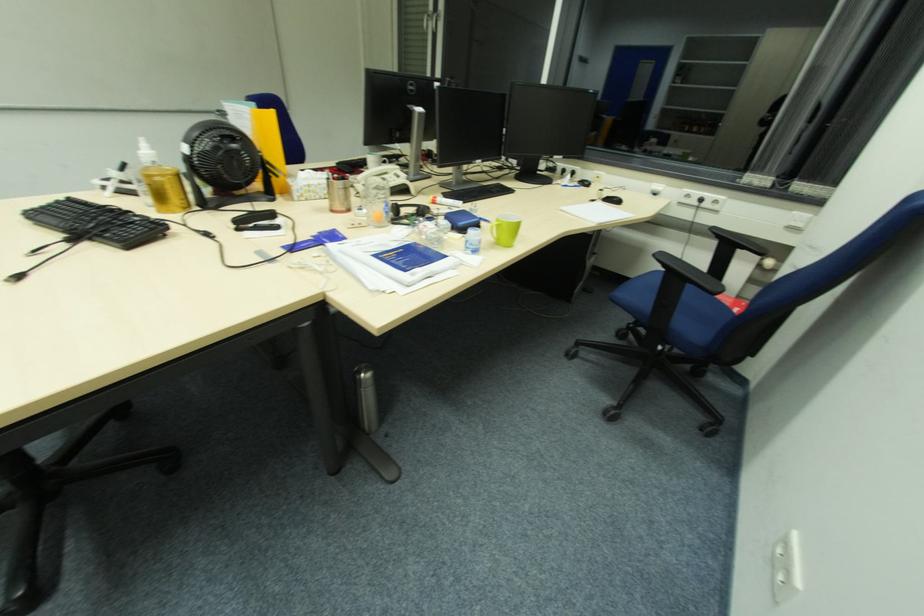
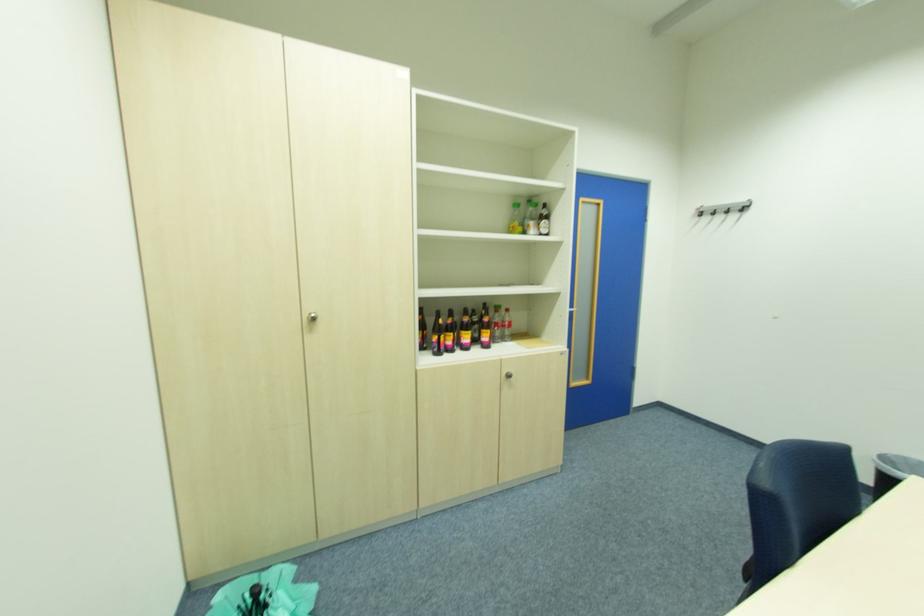
First-person continuous shooting, in which direction is the camera rotating?

The camera's rotation is toward left-down.